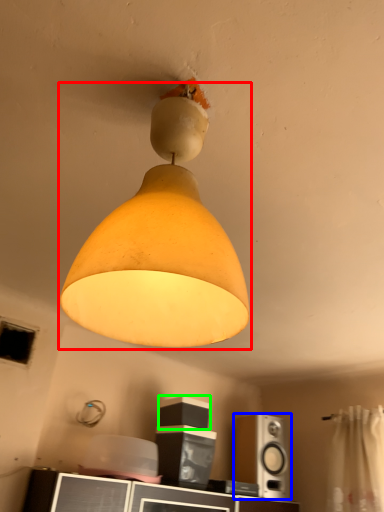
Question: Which is farther away from lamp (highlighted by a red box)? speaker (highlighted by a blue box) or speaker (highlighted by a green box)?

Choices:
 (A) speaker
 (B) speaker

Answer: (A)